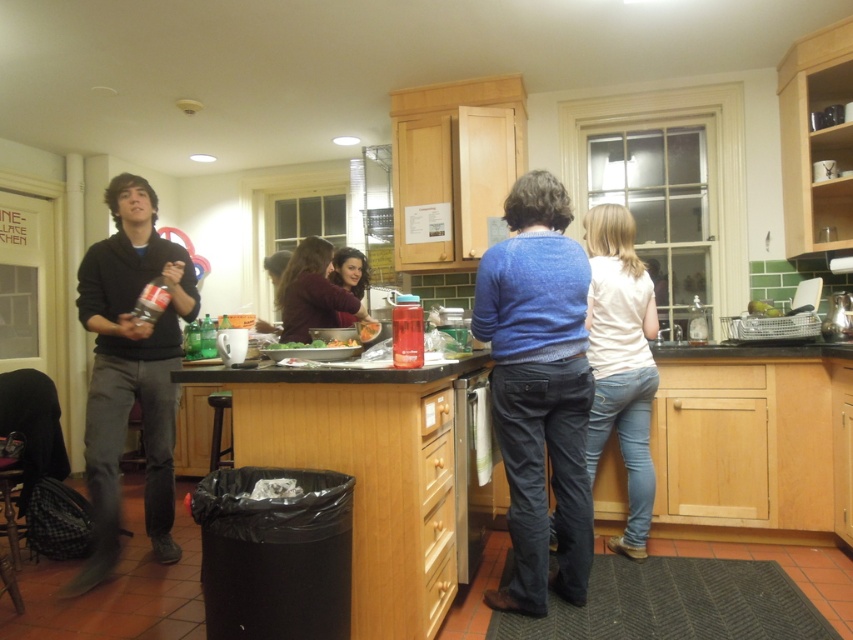
Question: Which of the following is the farthest from the observer?

Choices:
 (A) (334, 278)
 (B) (579, 300)
 (C) (704, 333)

Answer: (A)

Question: Which of the following is the farthest from the observer?

Choices:
 (A) (173, 500)
 (B) (288, 342)
 (C) (334, 312)
 (D) (363, 266)

Answer: (D)

Question: Is blue sweater at center thinner than green leafy vegetables at center?

Choices:
 (A) no
 (B) yes

Answer: (A)

Question: Which of the following is the closest to the observer?

Choices:
 (A) white matte shirt at center
 (B) blue sweater at center
 (C) metallic silver dishwasher at lower center

Answer: (B)

Question: Is blue sweater at center positioned in front of green leafy vegetables at center?

Choices:
 (A) yes
 (B) no

Answer: (A)

Question: Does clear glass bottle at center appear under green leafy vegetables at center?

Choices:
 (A) no
 (B) yes

Answer: (A)